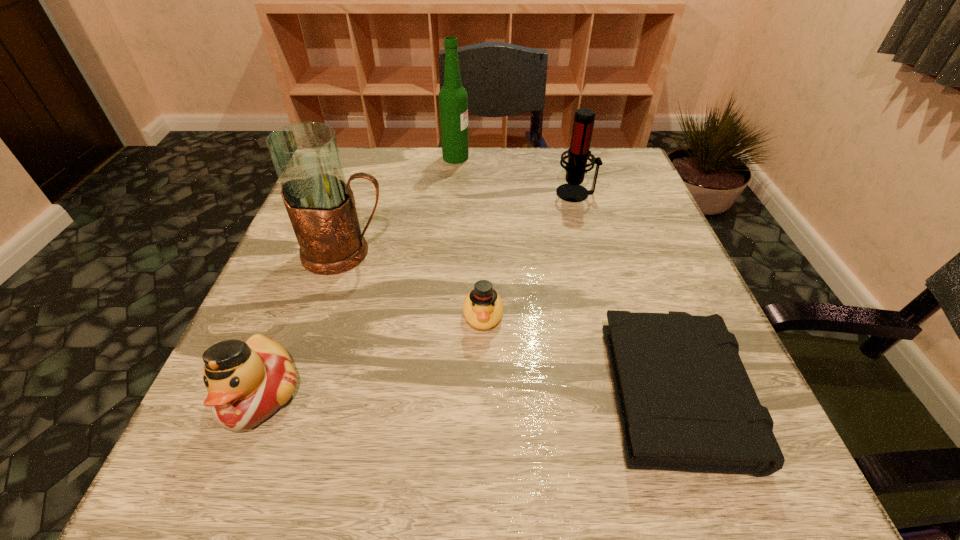
Identify the location of vacant region located 0.390m on the label of the farthest object. This screenshot has width=960, height=540. (615, 157).

Where is `vacant space located 0.190m with the handle on the side of the fifth shortest object`? This screenshot has height=540, width=960. vacant space located 0.190m with the handle on the side of the fifth shortest object is located at coordinates (484, 253).

This screenshot has height=540, width=960. I want to click on vacant position located on the left of the fifth nearest object, so click(x=502, y=193).

This screenshot has width=960, height=540. In order to click on vacant position located on the face of the left duck in this screenshot , I will do `click(223, 484)`.

Find the location of a particular element. vacant space located 0.050m on the front-facing side of the farther duck is located at coordinates (484, 363).

Where is `vacant space situated 0.350m on the back of the Bible`? The width and height of the screenshot is (960, 540). vacant space situated 0.350m on the back of the Bible is located at coordinates (607, 203).

This screenshot has width=960, height=540. I want to click on beer bottle positioned at the far edge, so click(x=453, y=99).

What are the coordinates of `microphone that is at the far edge` in the screenshot? It's located at (578, 153).

Find the location of a particular element. This screenshot has width=960, height=540. object that is at the near edge is located at coordinates (685, 401).

In order to click on pitcher situated at the left edge in this screenshot , I will do `click(319, 201)`.